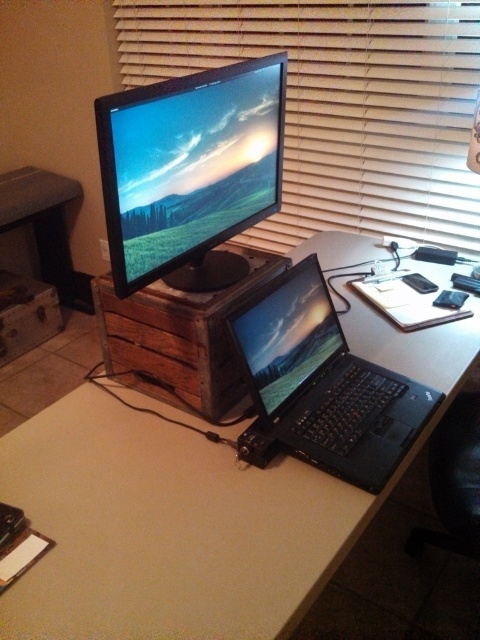
Question: Can you confirm if satin black monitor at upper center is bigger than black matte laptop at center?

Choices:
 (A) no
 (B) yes

Answer: (B)

Question: Can you confirm if wooden blind at upper center is bigger than glossy plastic laptop at center?

Choices:
 (A) no
 (B) yes

Answer: (B)

Question: Which of the following is the farthest from the observer?

Choices:
 (A) (45, 563)
 (B) (145, 259)
 (C) (314, 342)
 (D) (313, 220)

Answer: (D)

Question: Which point appears closest to the camera in this image?

Choices:
 (A) (156, 92)
 (B) (265, 307)
 (C) (312, 314)

Answer: (A)

Question: Which object is the closest to the satin black monitor at upper center?

Choices:
 (A) black matte laptop at center
 (B) wooden blind at upper center
 (C) wooden crate at center

Answer: (A)

Question: Does wooden blind at upper center come in front of glossy plastic laptop at center?

Choices:
 (A) no
 (B) yes

Answer: (A)